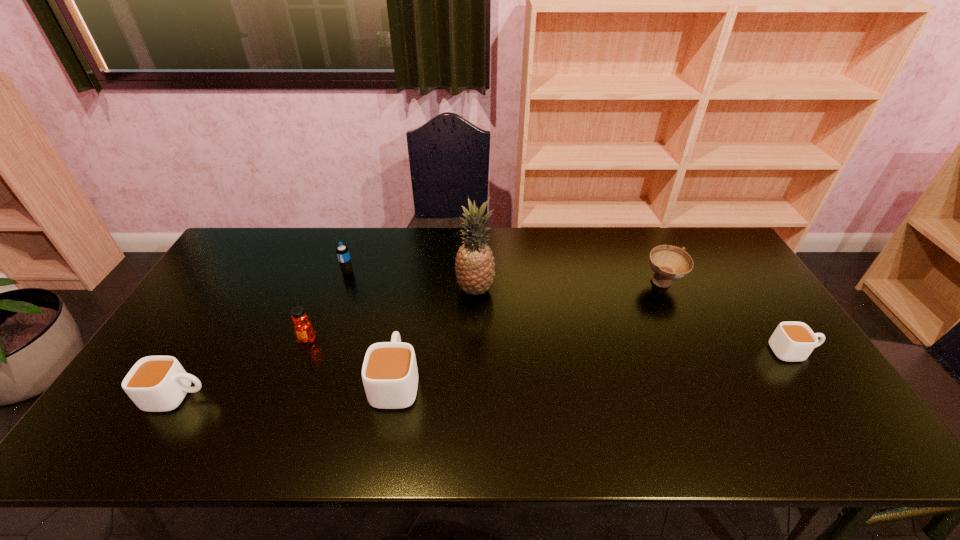
Locate an element on the screen. The height and width of the screenshot is (540, 960). the second object from left to right is located at coordinates (303, 329).

Identify the location of free spot located 0.270m on the side with the handle of the leftmost cup. (319, 396).

Identify the location of vacant space located 0.210m on the side with the handle of the fourth object from right to left. The width and height of the screenshot is (960, 540). (410, 299).

At what (x,y) coordinates should I click in order to perform the action: click on vacant space located 0.060m on the side with the handle of the fourth object from right to left. Please return your answer as a coordinate pair (x, y). Image resolution: width=960 pixels, height=540 pixels. Looking at the image, I should click on (404, 336).

Locate an element on the screen. This screenshot has height=540, width=960. free location located on the side with the handle of the fourth object from right to left is located at coordinates (409, 306).

Identify the location of free space located 0.220m on the back of the fifth object from right to left. point(362,230).

Where is `free spot located 0.330m on the right of the tallest object`? This screenshot has height=540, width=960. free spot located 0.330m on the right of the tallest object is located at coordinates (601, 290).

This screenshot has height=540, width=960. Identify the location of free space located on the front of the sixth object from left to right. (694, 351).

Locate an element on the screen. blank space located 0.070m on the front label of the sixth object from right to left is located at coordinates (297, 366).

Where is `object at the far edge`? Image resolution: width=960 pixels, height=540 pixels. object at the far edge is located at coordinates (342, 251).